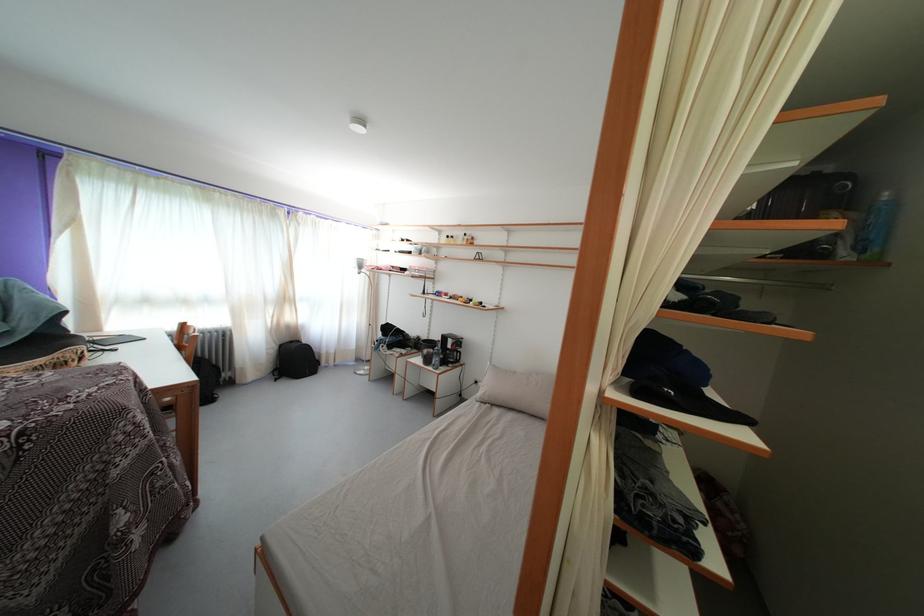
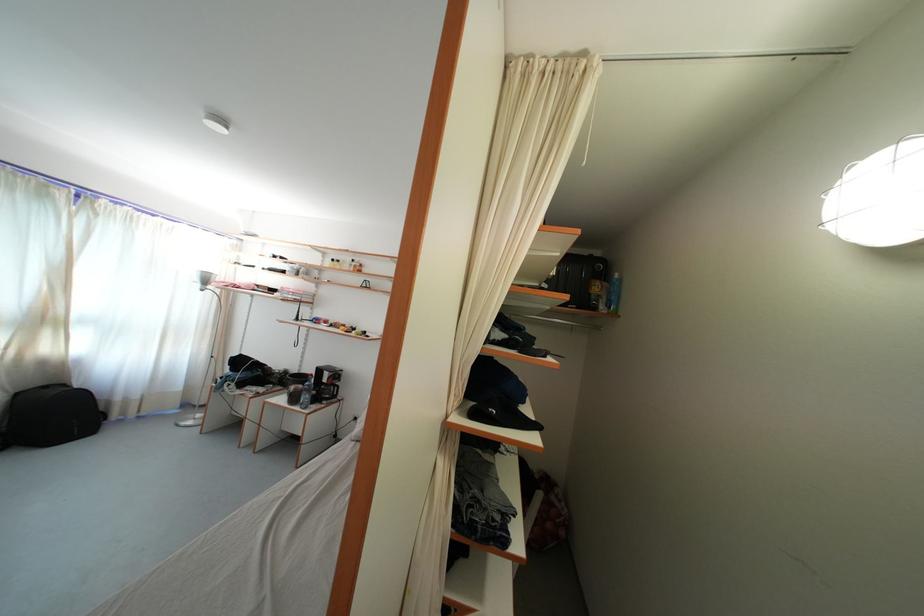
The point at (292, 305) is marked in the first image. Where is the corresponding point in the second image?

(52, 326)